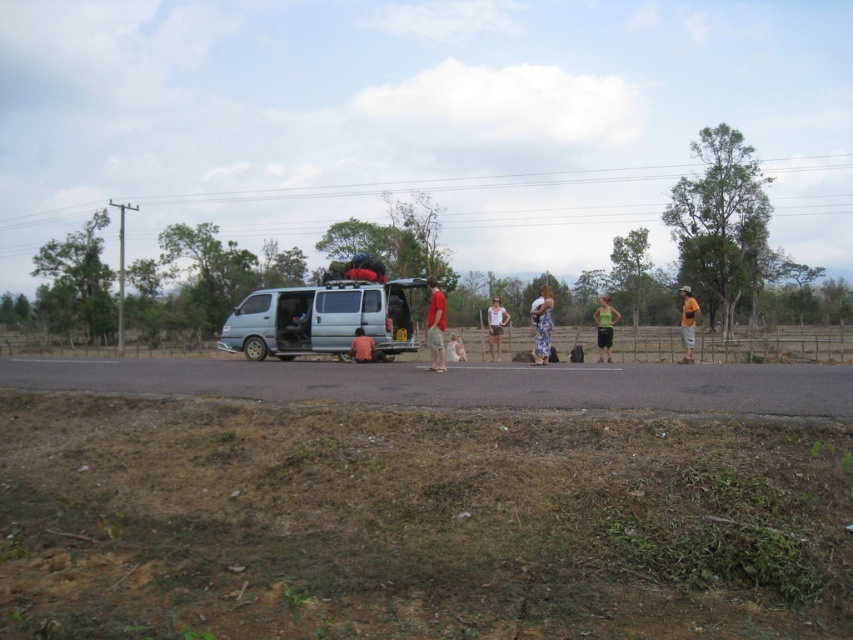
Describe the element at coordinates (321, 320) in the screenshot. This screenshot has width=853, height=640. I see `silver metallic van at center` at that location.

Which is below, silver metallic van at center or light brown fabric shorts at center?

light brown fabric shorts at center is lower down.

This screenshot has height=640, width=853. Describe the element at coordinates (321, 320) in the screenshot. I see `silver metallic van at center` at that location.

Locate an element on the screen. The image size is (853, 640). silver metallic van at center is located at coordinates (321, 320).

Between silver metallic van at center and floral dress at center, which one appears on the right side from the viewer's perspective?

floral dress at center

Does silver metallic van at center have a larger size compared to floral dress at center?

Actually, silver metallic van at center might be smaller than floral dress at center.

Which is behind, point (271, 308) or point (543, 332)?

The point (271, 308) is behind.

Locate an element on the screen. The image size is (853, 640). silver metallic van at center is located at coordinates (321, 320).

Does green fabric shorts at center appear on the right side of pink fabric at center?

Indeed, green fabric shorts at center is positioned on the right side of pink fabric at center.

Can you confirm if green fabric shorts at center is positioned above pink fabric at center?

Indeed, green fabric shorts at center is positioned over pink fabric at center.

This screenshot has width=853, height=640. Identify the location of green fabric shorts at center. (604, 326).